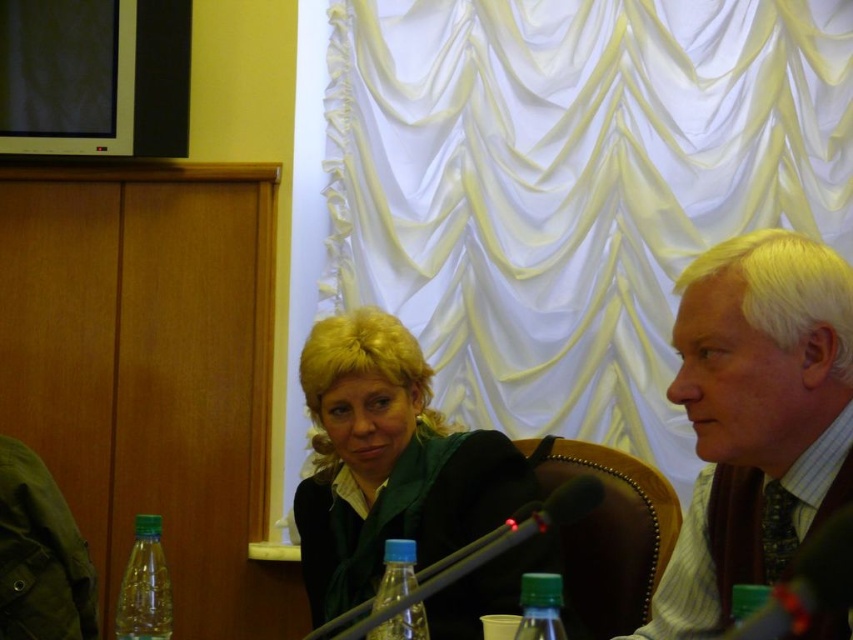
You are standing in the conference room and want to place a 3.0 meter long banner between the point at coordinates (453, 118) and yourself. Is there enough space to hang the banner without folding it?

The distance between the point at coordinates (453, 118) and the viewer is 2.70 meters. Since the banner is 3.0 meters long, which is longer than the available space, it won

You are a photographer setting up for a presentation in this room. You need to position your camera so that it captures the white satin curtain at upper center at point (572, 188). What coordinates should you aim for?

The white satin curtain at upper center is located at point (572, 188), so you should aim your camera at those coordinates to capture it.